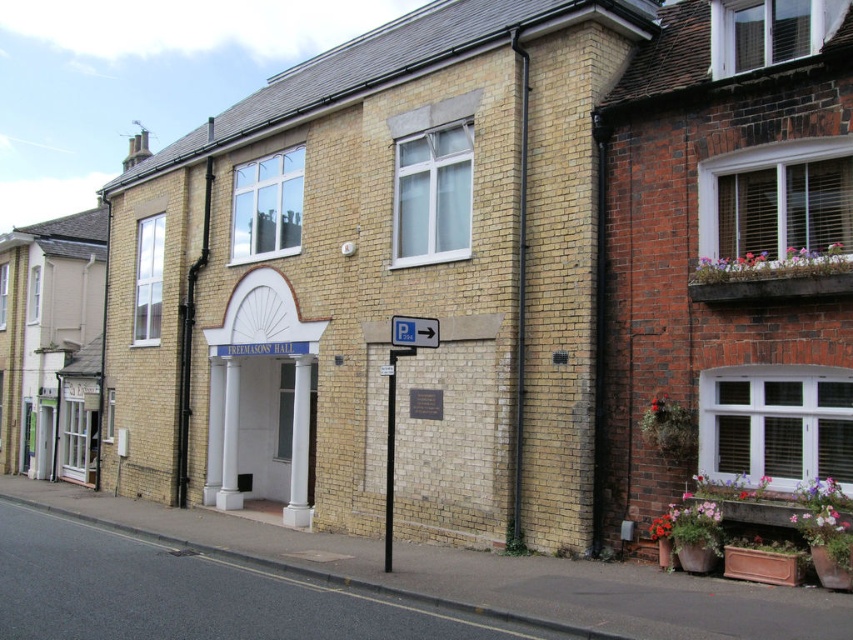
You are a city planner assessing the street layout. The smooth black pole at center and the white plastic sign at center are both in the same area. Which object is narrower?

The smooth black pole at center is narrower than the white plastic sign at center.

You are a city planner assessing the street layout. You need to install a new streetlight that must be at least 2 meters taller than any nearby signage. The smooth black pole at center and the white plastic sign at center are in the area. Can the proposed streetlight be placed here without violating the height requirement?

The smooth black pole at center is taller than the white plastic sign at center. Since the streetlight must be at least 2 meters taller than any nearby signage, and the smooth black pole is already taller than the sign, the streetlight would need to be 2 meters taller than the smooth black pole to comply with the requirement. However, without knowing the exact height of the smooth black pole, it is impossible to confirm if the proposed streetlight meets the height requirement.

You are standing at the corner of the Freemasons Hall and want to locate the smooth black pole at center. Based on the coordinates provided, in which direction should you walk to reach it?

The smooth black pole at center is located at coordinates point (x=389, y=465), so you should walk towards the center of the image to reach it.